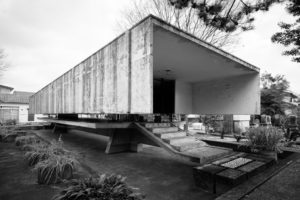
The image size is (300, 200). Identify the location of grassy plant. (63, 164).